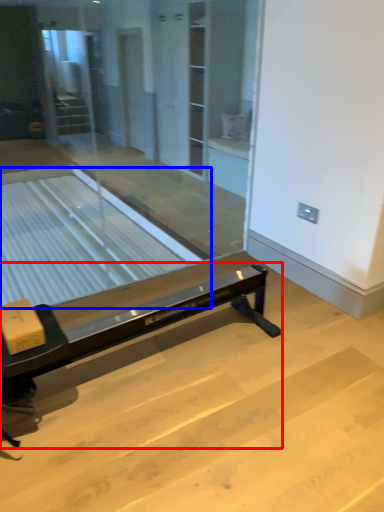
Question: Which point is closer to the camera, furniture (highlighted by a red box) or table (highlighted by a blue box)?

Choices:
 (A) furniture
 (B) table

Answer: (A)